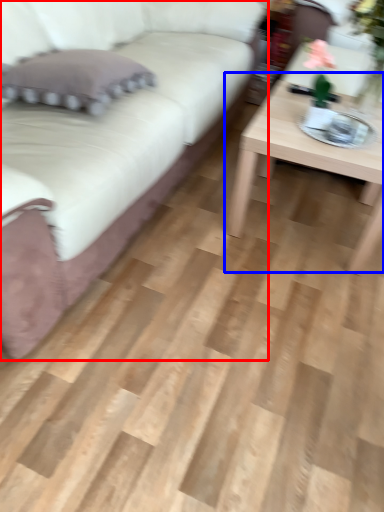
Question: Which point is closer to the camera, studio couch (highlighted by a red box) or coffee table (highlighted by a blue box)?

Choices:
 (A) studio couch
 (B) coffee table

Answer: (A)